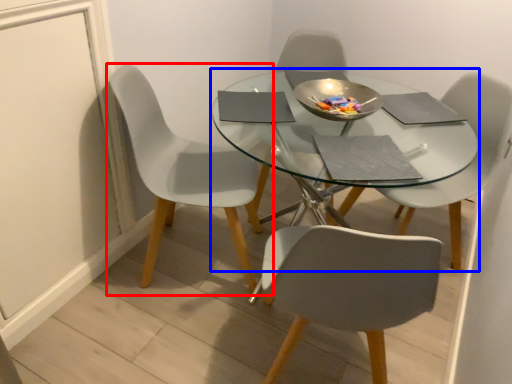
Question: Which point is further to the camera, chair (highlighted by a red box) or round table (highlighted by a blue box)?

Choices:
 (A) chair
 (B) round table

Answer: (A)